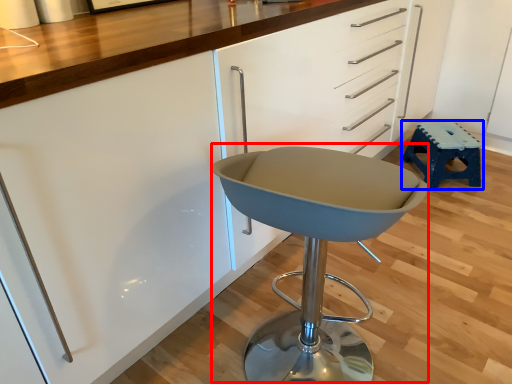
Question: Which object is further to the camera taking this photo, swivel chair (highlighted by a red box) or stool (highlighted by a blue box)?

Choices:
 (A) swivel chair
 (B) stool

Answer: (B)